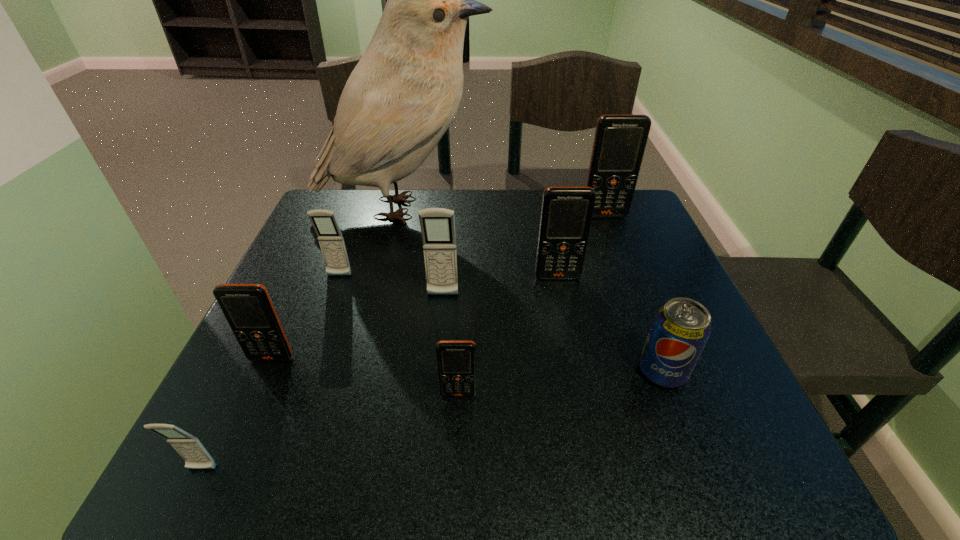
I want to click on the leftmost orange cellular telephone, so click(248, 309).

Where is `the third farthest orange cellular telephone`? Image resolution: width=960 pixels, height=540 pixels. the third farthest orange cellular telephone is located at coordinates (248, 309).

The image size is (960, 540). I want to click on soda, so coord(681,328).

Where is `the nearest orange cellular telephone`? the nearest orange cellular telephone is located at coordinates (456, 359).

This screenshot has height=540, width=960. What are the coordinates of `the third orange cellular telephone from right to left` in the screenshot? It's located at (456, 359).

The height and width of the screenshot is (540, 960). Identify the location of the smallest gray cellular telephone. (189, 447).

What are the coordinates of `the leftmost gray cellular telephone` in the screenshot? It's located at (189, 447).

At what (x,y) coordinates should I click in order to perform the action: click on free location located 0.270m on the face of the tallest object. Please return your answer as a coordinate pair (x, y). Looking at the image, I should click on (589, 208).

Where is `free space located 0.270m on the screen of the rightmost orange cellular telephone`? free space located 0.270m on the screen of the rightmost orange cellular telephone is located at coordinates pos(633,288).

Find the location of a particular element. This screenshot has width=960, height=540. vacant space located on the front-facing side of the rightmost gray cellular telephone is located at coordinates (438, 353).